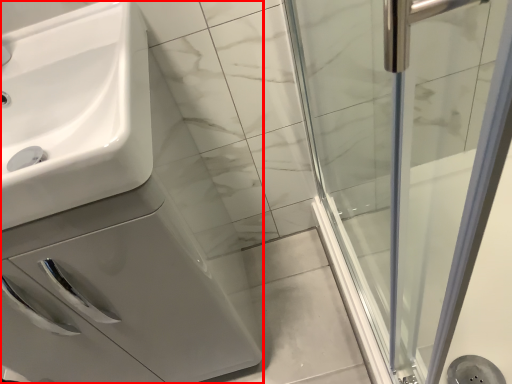
Question: From the image's perspective, what is the correct spatial relationship of porcelain (annotated by the red box) in relation to sink?

Choices:
 (A) above
 (B) below

Answer: (B)